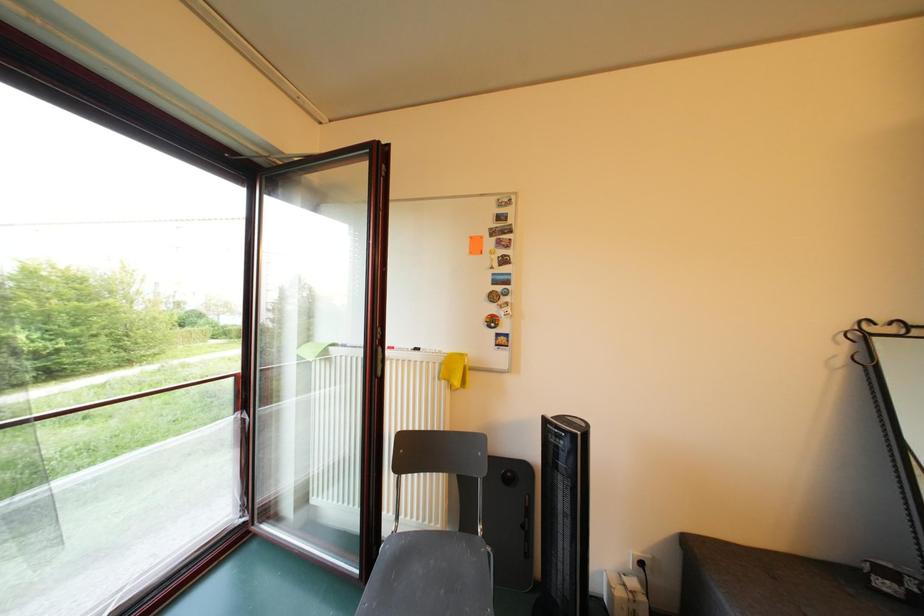
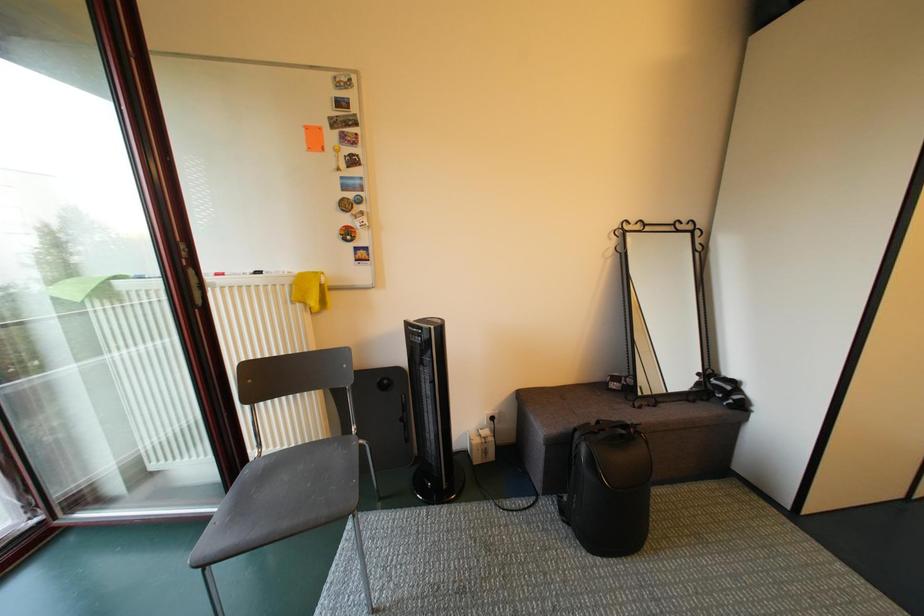
Question: How did the camera likely rotate?

Choices:
 (A) Left
 (B) Right
 (C) Up
 (D) Down

Answer: (B)